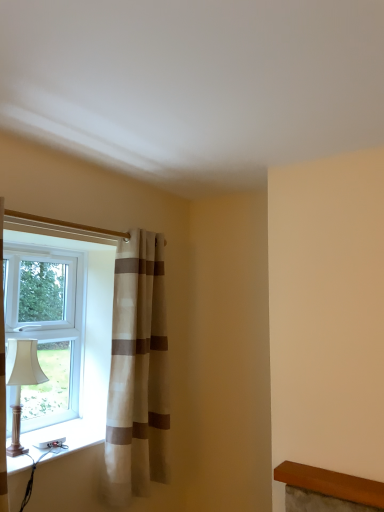
Question: Choose the correct answer: Is matte white lampshade at left inside beige striped curtain at left or outside it?

Choices:
 (A) inside
 (B) outside

Answer: (B)

Question: Does point (34, 375) appear closer or farther from the camera than point (122, 290)?

Choices:
 (A) closer
 (B) farther

Answer: (A)

Question: Which of these objects is positioned closest to the beige striped curtain at left?

Choices:
 (A) white plastic window sill at lower left
 (B) matte white lampshade at left
 (C) white plastic window at left

Answer: (C)

Question: Estimate the real-world distances between objects in this image. Which object is closer to the white plastic window at left?

Choices:
 (A) white plastic window sill at lower left
 (B) matte white lampshade at left
 (C) beige striped curtain at left

Answer: (C)